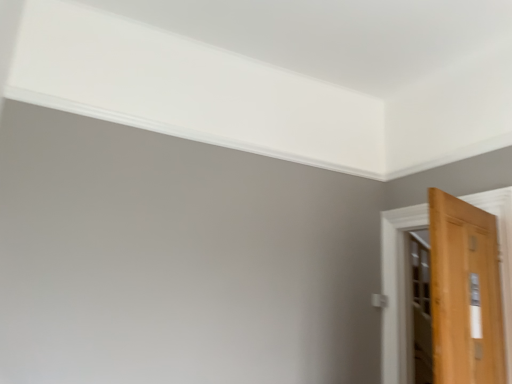
The image size is (512, 384). What do you see at coordinates (397, 290) in the screenshot?
I see `wooden door at right` at bounding box center [397, 290].

The width and height of the screenshot is (512, 384). In order to click on wooden door at right in this screenshot , I will do `click(397, 290)`.

Locate an element on the screen. The height and width of the screenshot is (384, 512). wooden door at right is located at coordinates (397, 290).